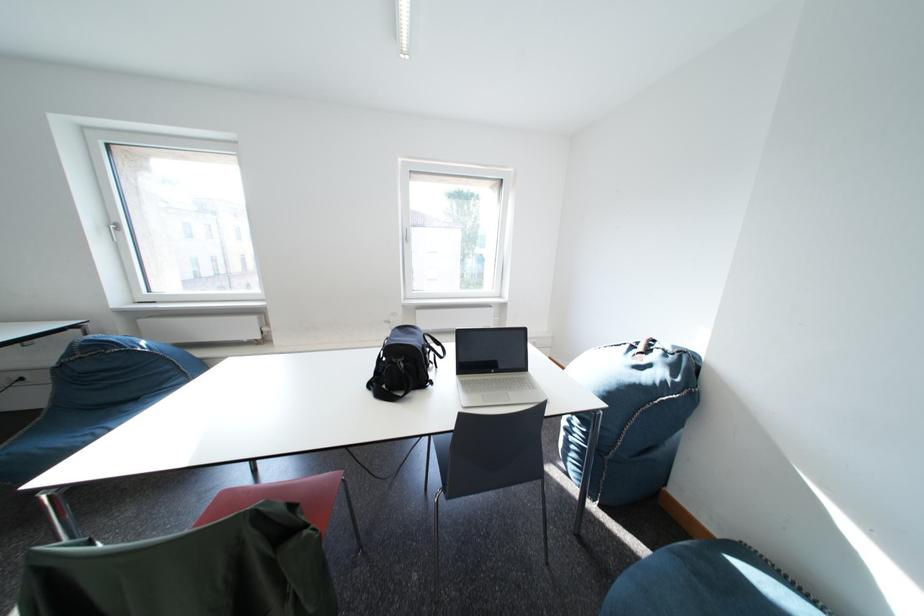
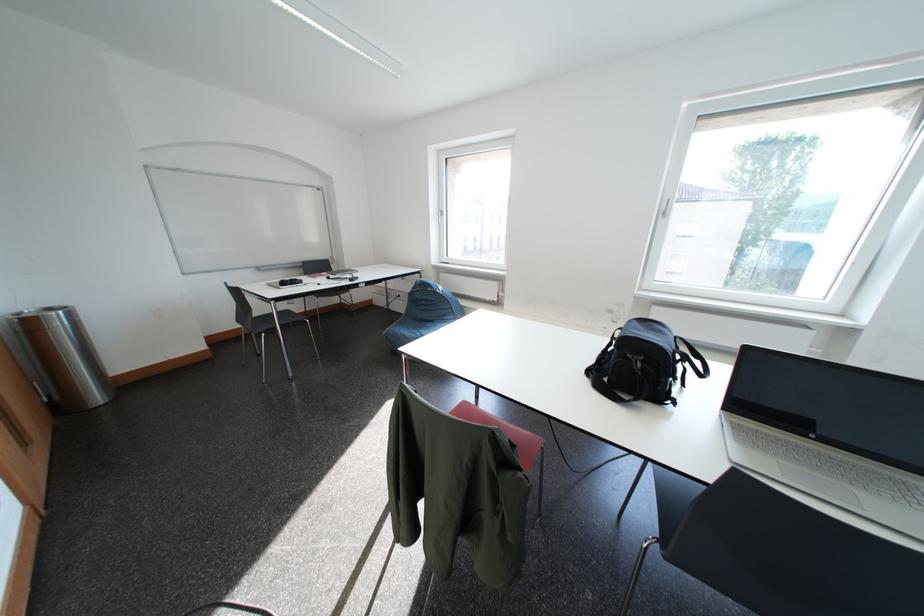
Where in the second image is the point corresponding to point (408, 334) from the first image?

(648, 326)